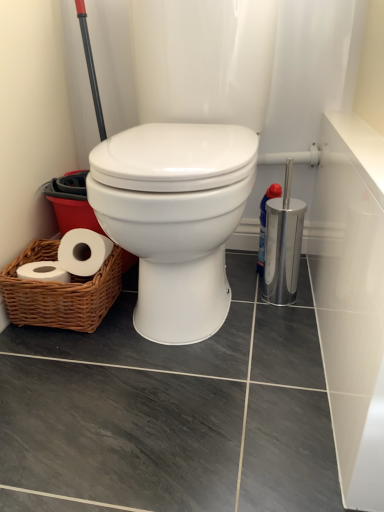
Identify the location of white glossy toilet at center. click(175, 218).

What do you see at coordinates (175, 218) in the screenshot? I see `white glossy toilet at center` at bounding box center [175, 218].

At what (x,y) coordinates should I click in order to perform the action: click on woven brown basket at lower left. Please return your answer as a coordinate pair (x, y). Looking at the image, I should click on (x=60, y=292).

What do you see at coordinates (60, 292) in the screenshot? The height and width of the screenshot is (512, 384). I see `woven brown basket at lower left` at bounding box center [60, 292].

The width and height of the screenshot is (384, 512). I want to click on white glossy toilet at center, so click(175, 218).

Considering the relative positions of woven brown basket at lower left and white glossy toilet at center in the image provided, is woven brown basket at lower left to the left of white glossy toilet at center from the viewer's perspective?

Yes.

Which is behind, woven brown basket at lower left or white glossy toilet at center?

woven brown basket at lower left is behind.

Is point (35, 312) positioned before point (132, 146)?

No, (35, 312) is behind (132, 146).

From the image's perspective, which is below, woven brown basket at lower left or white glossy toilet at center?

woven brown basket at lower left, from the image's perspective.

From a real-world perspective, which is physically above, woven brown basket at lower left or white glossy toilet at center?

In real-world perspective, white glossy toilet at center is above.

Looking at their sizes, would you say woven brown basket at lower left is wider or thinner than white glossy toilet at center?

Clearly, woven brown basket at lower left has less width compared to white glossy toilet at center.

Does woven brown basket at lower left have a lesser height compared to white glossy toilet at center?

Indeed, woven brown basket at lower left has a lesser height compared to white glossy toilet at center.

Is woven brown basket at lower left bigger than white glossy toilet at center?

Actually, woven brown basket at lower left might be smaller than white glossy toilet at center.

Is woven brown basket at lower left completely or partially outside of white glossy toilet at center?

Yes.

Is woven brown basket at lower left beside white glossy toilet at center?

woven brown basket at lower left and white glossy toilet at center are not in contact.

Is woven brown basket at lower left aimed at white glossy toilet at center?

No, woven brown basket at lower left is not aimed at white glossy toilet at center.

Locate an element on the screen. This screenshot has width=384, height=512. toilet on the right of woven brown basket at lower left is located at coordinates (175, 218).

Considering the positions of objects white glossy toilet at center and woven brown basket at lower left in the image provided, who is more to the left, white glossy toilet at center or woven brown basket at lower left?

woven brown basket at lower left is more to the left.

Is white glossy toilet at center positioned before woven brown basket at lower left?

Yes, white glossy toilet at center is closer to the viewer.

Which is less distant, [137,232] or [80,322]?

Point [137,232].

From the image's perspective, would you say white glossy toilet at center is shown under woven brown basket at lower left?

No.

From a real-world perspective, relative to woven brown basket at lower left, is white glossy toilet at center vertically above or below?

In terms of real-world spatial position, white glossy toilet at center is above woven brown basket at lower left.

Can you confirm if white glossy toilet at center is thinner than woven brown basket at lower left?

Incorrect, the width of white glossy toilet at center is not less than that of woven brown basket at lower left.

Is white glossy toilet at center shorter than woven brown basket at lower left?

In fact, white glossy toilet at center may be taller than woven brown basket at lower left.

Considering the relative sizes of white glossy toilet at center and woven brown basket at lower left in the image provided, is white glossy toilet at center smaller than woven brown basket at lower left?

No.

Do you think white glossy toilet at center is within woven brown basket at lower left, or outside of it?

white glossy toilet at center is outside woven brown basket at lower left.

Are white glossy toilet at center and woven brown basket at lower left far apart?

No, there isn't a large distance between white glossy toilet at center and woven brown basket at lower left.

Is woven brown basket at lower left at the back of white glossy toilet at center?

white glossy toilet at center does not have its back to woven brown basket at lower left.

How many degrees apart are the facing directions of white glossy toilet at center and woven brown basket at lower left?

The facing directions of white glossy toilet at center and woven brown basket at lower left are 1.41 degrees apart.

How distant is white glossy toilet at center from woven brown basket at lower left?

A distance of 10.55 inches exists between white glossy toilet at center and woven brown basket at lower left.

Identify the location of toilet positioned vertically above the woven brown basket at lower left (from a real-world perspective). (175, 218).

Find the location of `toilet on the right of woven brown basket at lower left`. toilet on the right of woven brown basket at lower left is located at coordinates (175, 218).

This screenshot has width=384, height=512. I want to click on toilet in front of the woven brown basket at lower left, so click(x=175, y=218).